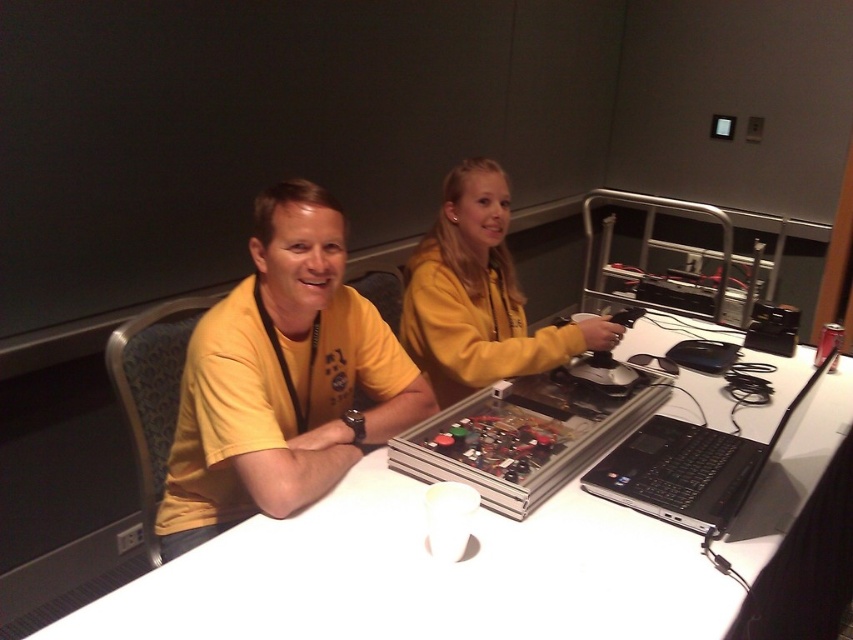
Question: Is matte yellow shirt at center to the left of yellow fleece at center from the viewer's perspective?

Choices:
 (A) no
 (B) yes

Answer: (B)

Question: Which point is closer to the camera?

Choices:
 (A) (473, 360)
 (B) (619, 484)
 (C) (236, 388)
 (D) (354, 545)

Answer: (D)

Question: Which of the following is the farthest from the observer?

Choices:
 (A) (489, 196)
 (B) (659, 330)
 (C) (791, 413)
 (D) (368, 355)

Answer: (B)

Question: Can you confirm if yellow fleece at center is positioned to the left of black matte laptop at lower right?

Choices:
 (A) yes
 (B) no

Answer: (A)

Question: Considering the real-world distances, which object is closest to the yellow fleece at center?

Choices:
 (A) matte yellow shirt at center
 (B) black matte laptop at lower right
 (C) white glossy table at center

Answer: (A)

Question: Does white glossy table at center have a lesser width compared to matte yellow shirt at center?

Choices:
 (A) no
 (B) yes

Answer: (A)